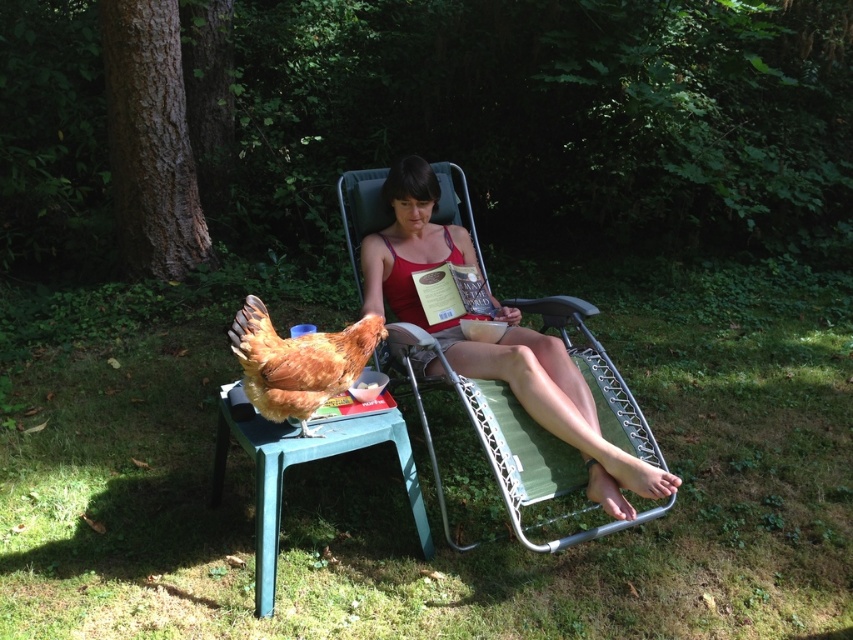
Does matte red tank top at center have a smaller size compared to brown feathered chicken at lower left?

No, matte red tank top at center is not smaller than brown feathered chicken at lower left.

Is matte red tank top at center shorter than brown feathered chicken at lower left?

Incorrect, matte red tank top at center's height does not fall short of brown feathered chicken at lower left's.

Which is behind, point (589, 419) or point (299, 435)?

The point (589, 419) is more distant.

I want to click on matte red tank top at center, so click(x=498, y=340).